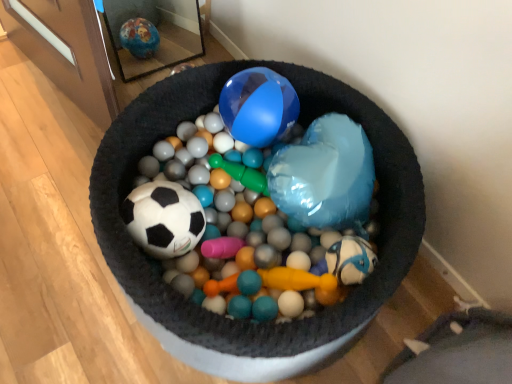
The height and width of the screenshot is (384, 512). Describe the element at coordinates (257, 209) in the screenshot. I see `matte black soccer ball at center` at that location.

What is the approximate width of matte black soccer ball at center?

It is 30.02 inches.

Image resolution: width=512 pixels, height=384 pixels. What are the coordinates of `matte black soccer ball at center` in the screenshot? It's located at (257, 209).

What is the approximate width of gray fabric bean bag chair at lower right?

The width of gray fabric bean bag chair at lower right is 16.65 inches.

Where is `gray fabric bean bag chair at lower right`? This screenshot has width=512, height=384. gray fabric bean bag chair at lower right is located at coordinates (458, 352).

The image size is (512, 384). Describe the element at coordinates (458, 352) in the screenshot. I see `gray fabric bean bag chair at lower right` at that location.

Identify the location of matte black soccer ball at center. tap(257, 209).

Is matte black soccer ball at center at the right side of gray fabric bean bag chair at lower right?

No.

Relative to gray fabric bean bag chair at lower right, is matte black soccer ball at center in front or behind?

matte black soccer ball at center is in front of gray fabric bean bag chair at lower right.

Which point is more distant from viewer, (x=359, y=126) or (x=469, y=366)?

The point (x=359, y=126) is farther.

From the image's perspective, which one is positioned higher, matte black soccer ball at center or gray fabric bean bag chair at lower right?

matte black soccer ball at center, from the image's perspective.

From a real-world perspective, is matte black soccer ball at center above or below gray fabric bean bag chair at lower right?

In terms of real-world spatial position, matte black soccer ball at center is above gray fabric bean bag chair at lower right.

Which object is wider, matte black soccer ball at center or gray fabric bean bag chair at lower right?

With larger width is matte black soccer ball at center.

Is matte black soccer ball at center shorter than gray fabric bean bag chair at lower right?

In fact, matte black soccer ball at center may be taller than gray fabric bean bag chair at lower right.

Who is smaller, matte black soccer ball at center or gray fabric bean bag chair at lower right?

With smaller size is gray fabric bean bag chair at lower right.

Is matte black soccer ball at center not within gray fabric bean bag chair at lower right?

Yes, matte black soccer ball at center is not within gray fabric bean bag chair at lower right.

Looking at this image, is matte black soccer ball at center in contact with gray fabric bean bag chair at lower right?

No.

Is matte black soccer ball at center turned away from gray fabric bean bag chair at lower right?

No, matte black soccer ball at center's orientation is not away from gray fabric bean bag chair at lower right.

Can you tell me how much matte black soccer ball at center and gray fabric bean bag chair at lower right differ in facing direction?

They differ by 6.71 degrees in their facing directions.

The width and height of the screenshot is (512, 384). In the image, there is a gray fabric bean bag chair at lower right. Find the location of `ball above it (from the image's perspective)`. ball above it (from the image's perspective) is located at coordinates (257, 209).

Is gray fabric bean bag chair at lower right at the left side of matte black soccer ball at center?

In fact, gray fabric bean bag chair at lower right is to the right of matte black soccer ball at center.

Is gray fabric bean bag chair at lower right further to camera compared to matte black soccer ball at center?

Yes, it is.

Is point (477, 318) positioned behind point (152, 190)?

Yes, it is behind point (152, 190).

From the image's perspective, who appears lower, gray fabric bean bag chair at lower right or matte black soccer ball at center?

gray fabric bean bag chair at lower right is shown below in the image.

From a real-world perspective, which object stands above the other?

matte black soccer ball at center.

Is gray fabric bean bag chair at lower right thinner than matte black soccer ball at center?

Indeed, gray fabric bean bag chair at lower right has a lesser width compared to matte black soccer ball at center.

Considering the sizes of objects gray fabric bean bag chair at lower right and matte black soccer ball at center in the image provided, who is taller, gray fabric bean bag chair at lower right or matte black soccer ball at center?

Standing taller between the two is matte black soccer ball at center.

Between gray fabric bean bag chair at lower right and matte black soccer ball at center, which one has smaller size?

Smaller between the two is gray fabric bean bag chair at lower right.

Is gray fabric bean bag chair at lower right spatially inside matte black soccer ball at center, or outside of it?

gray fabric bean bag chair at lower right is located beyond the bounds of matte black soccer ball at center.

Are gray fabric bean bag chair at lower right and matte black soccer ball at center located far from each other?

No.

Is gray fabric bean bag chair at lower right positioned with its back to matte black soccer ball at center?

gray fabric bean bag chair at lower right is not turned away from matte black soccer ball at center.

How different are the orientations of gray fabric bean bag chair at lower right and matte black soccer ball at center in degrees?

They differ by 6.71 degrees in their facing directions.

This screenshot has width=512, height=384. Find the location of `ball that appears in front of the gray fabric bean bag chair at lower right`. ball that appears in front of the gray fabric bean bag chair at lower right is located at coordinates (257, 209).

Where is `ball in front of the gray fabric bean bag chair at lower right`? This screenshot has height=384, width=512. ball in front of the gray fabric bean bag chair at lower right is located at coordinates (257, 209).

Image resolution: width=512 pixels, height=384 pixels. Identify the location of ball above the gray fabric bean bag chair at lower right (from a real-world perspective). (257, 209).